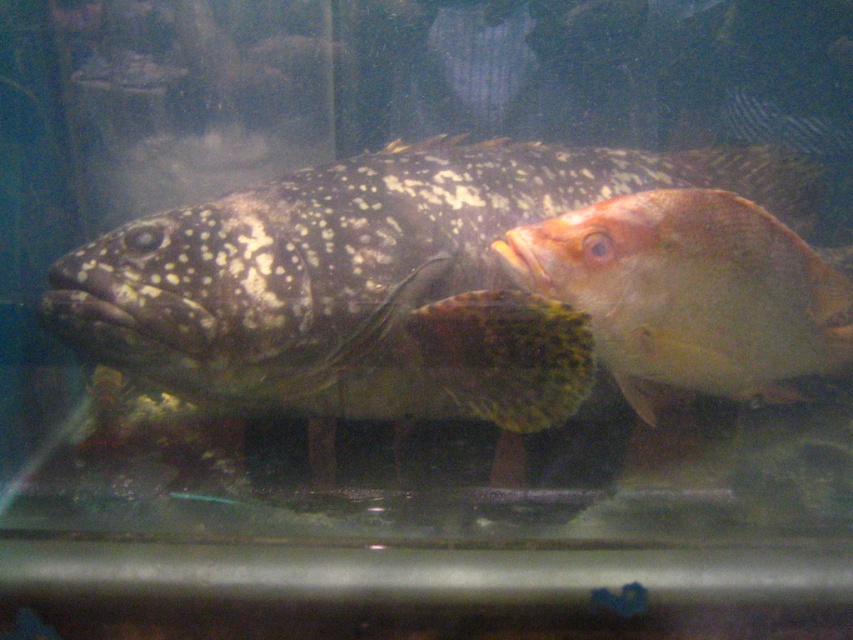
Question: Does speckled matte fish at center come behind shiny orange fish at right?

Choices:
 (A) no
 (B) yes

Answer: (B)

Question: Which object is farther from the camera taking this photo?

Choices:
 (A) speckled matte fish at center
 (B) shiny orange fish at right

Answer: (A)

Question: Which of the following is the closest to the observer?

Choices:
 (A) (171, 378)
 (B) (704, 356)

Answer: (B)

Question: Considering the relative positions of speckled matte fish at center and shiny orange fish at right in the image provided, where is speckled matte fish at center located with respect to shiny orange fish at right?

Choices:
 (A) below
 (B) above

Answer: (B)

Question: Which point is closer to the camera?

Choices:
 (A) (572, 392)
 (B) (787, 340)

Answer: (B)

Question: Considering the relative positions of speckled matte fish at center and shiny orange fish at right in the image provided, where is speckled matte fish at center located with respect to shiny orange fish at right?

Choices:
 (A) right
 (B) left

Answer: (B)